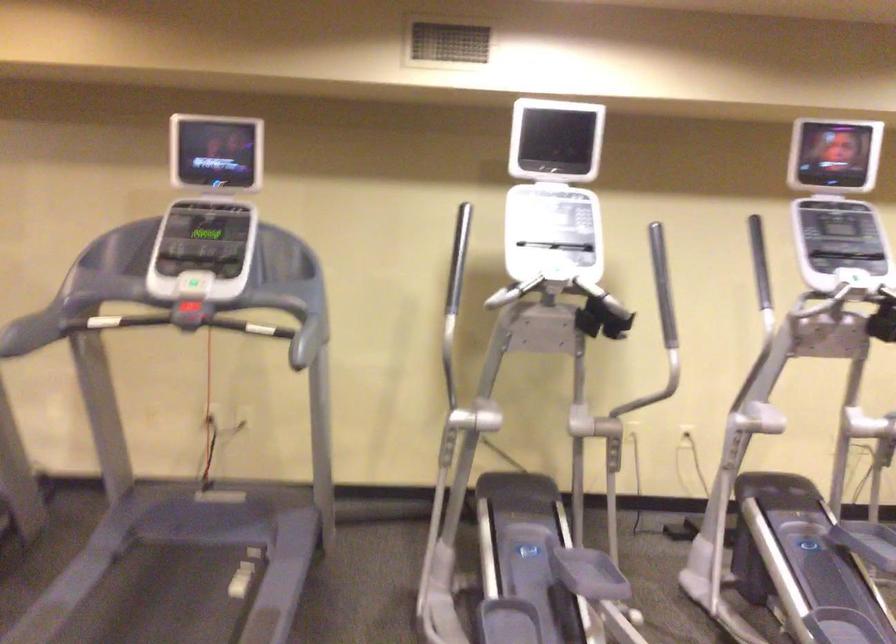
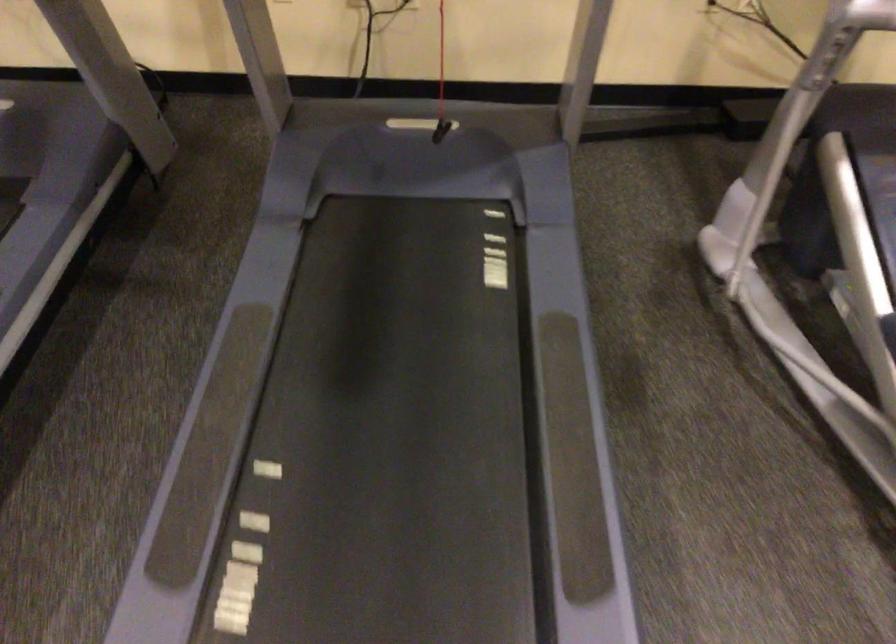
Where in the second image is the point corresponding to [500,535] from the first image?

(876, 190)